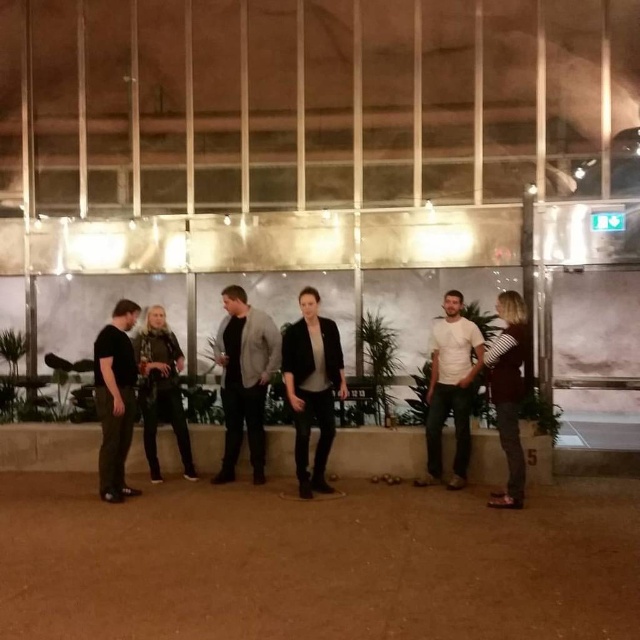
You are standing at the entrance of the lobby and want to locate the light gray textured blazer at center. According to the coordinates provided, in which direction should you look relative to your current position?

The light gray textured blazer at center is located at coordinates point (244, 378), which means it is positioned slightly to the right and forward from your current position at the entrance.